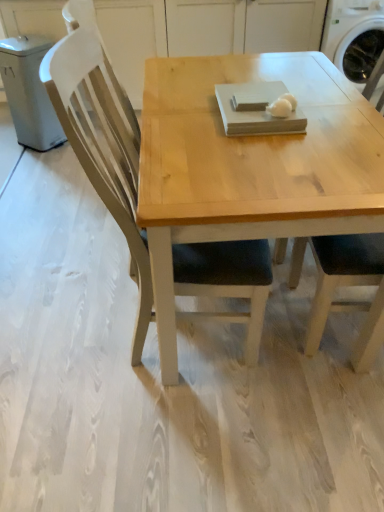
Find the location of `vacant area that is in front of matte wood chair at right`. vacant area that is in front of matte wood chair at right is located at coordinates (331, 420).